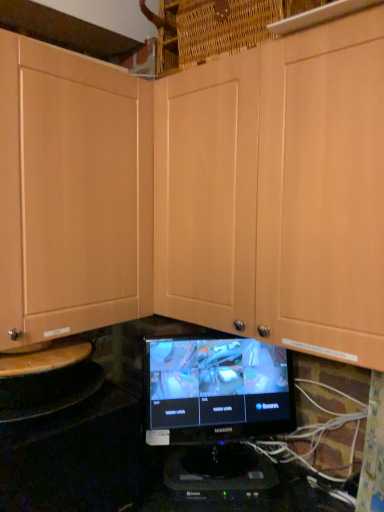
Identify the location of free point above black plastic monitor at center (from a real-world perspective). (212, 474).